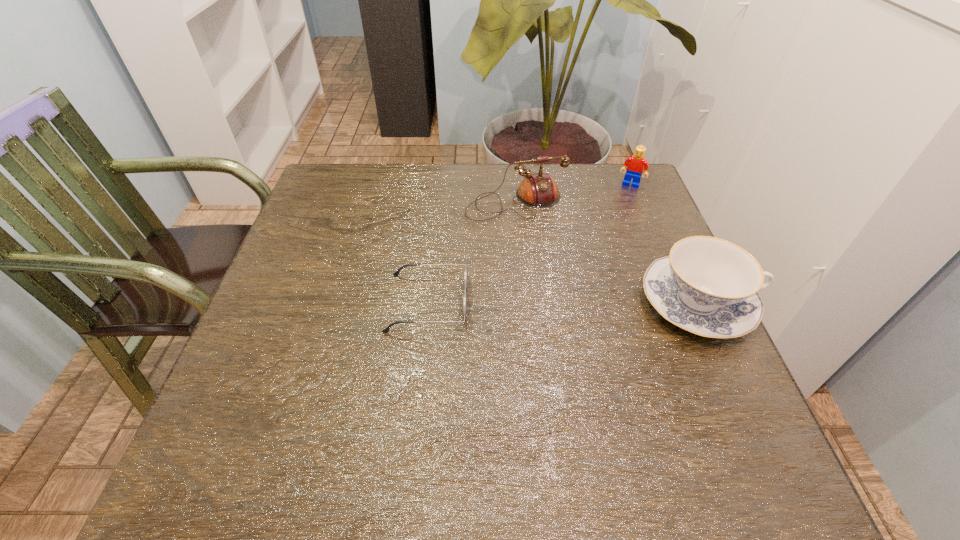
Locate an element on the screen. This screenshot has height=540, width=960. vacant area that lies between the sunglasses and the chinaware is located at coordinates (563, 303).

What are the coordinates of `vacant area that lies between the Lego and the chinaware` in the screenshot? It's located at (664, 244).

Identify the location of the second closest object relative to the chinaware. The height and width of the screenshot is (540, 960). (636, 164).

Find the location of a particular element. Image resolution: width=960 pixels, height=540 pixels. the closest object relative to the shortest object is located at coordinates (538, 190).

Where is `free spot that satisfies the following two spatial constraints: 1. on the front side of the telephone; 2. with the handle on the side of the chinaware`? This screenshot has width=960, height=540. free spot that satisfies the following two spatial constraints: 1. on the front side of the telephone; 2. with the handle on the side of the chinaware is located at coordinates (526, 303).

You are a GUI agent. You are given a task and a screenshot of the screen. Output one action in this format:
    pyautogui.click(x=<x>, y=<y>)
    Task: Click on the free point that satisfies the following two spatial constraints: 1. on the back side of the Lego; 2. on the left side of the telephone
    This screenshot has width=960, height=540.
    Given the screenshot: What is the action you would take?
    pyautogui.click(x=515, y=185)